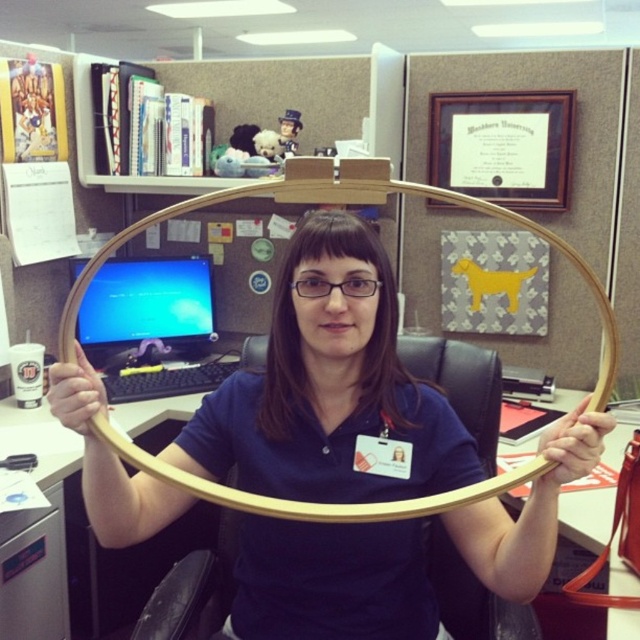
Question: Which of the following is the closest to the observer?

Choices:
 (A) matte gold hoop at center
 (B) blue glossy monitor at center

Answer: (A)

Question: Which point is farther to the camera?

Choices:
 (A) (196, 333)
 (B) (380, 301)

Answer: (A)

Question: From the image, what is the correct spatial relationship of matte gold hoop at center in relation to blue glossy monitor at center?

Choices:
 (A) right
 (B) left

Answer: (A)

Question: Is matte gold hoop at center to the left of blue glossy monitor at center from the viewer's perspective?

Choices:
 (A) yes
 (B) no

Answer: (B)

Question: Can you confirm if matte gold hoop at center is positioned below blue glossy monitor at center?

Choices:
 (A) no
 (B) yes

Answer: (B)